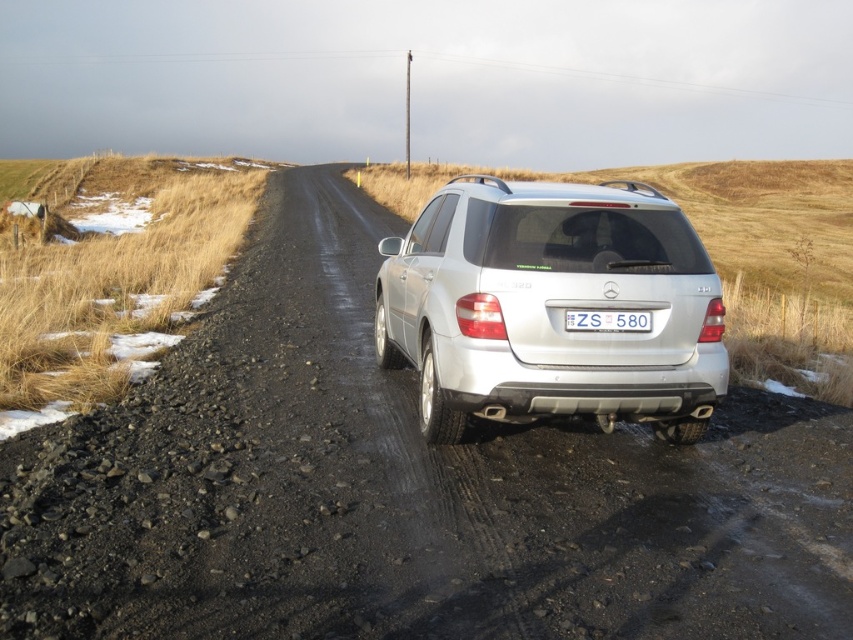
Consider the image. Between dirt track at center and white plastic license plate at center, which one appears on the right side from the viewer's perspective?

Positioned to the right is white plastic license plate at center.

Who is more forward, (728,477) or (570,310)?

Point (570,310)

Does point (114, 561) come behind point (614, 321)?

No, it is not.

Locate an element on the screen. dirt track at center is located at coordinates (402, 490).

Can you confirm if dirt track at center is positioned to the left of silver metallic suv at center?

Correct, you'll find dirt track at center to the left of silver metallic suv at center.

Which is in front, point (247, 449) or point (619, 205)?

Point (619, 205)

Is point (759, 604) farther from viewer compared to point (619, 401)?

No, (759, 604) is in front of (619, 401).

Identify the location of dirt track at center. (402, 490).

Which is more to the left, silver metallic suv at center or white plastic license plate at center?

Positioned to the left is silver metallic suv at center.

Where is `silver metallic suv at center`? The height and width of the screenshot is (640, 853). silver metallic suv at center is located at coordinates (550, 307).